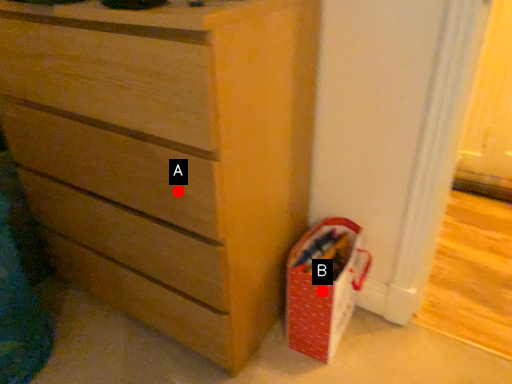
Question: Two points are circled on the image, labeled by A and B beside each circle. Among these points, which one is farthest from the camera?

Choices:
 (A) A is further
 (B) B is further

Answer: (B)